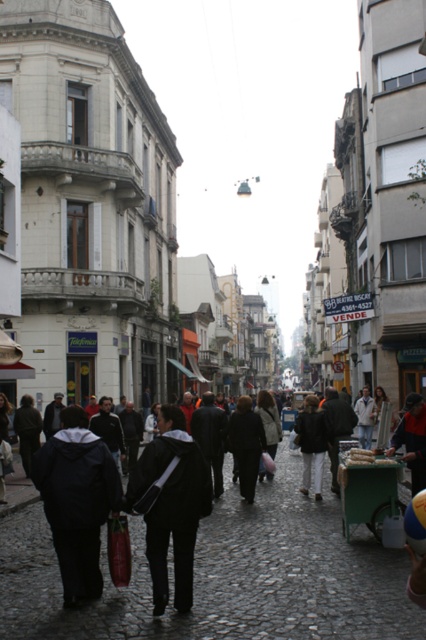
Which of these two, black fabric crowd at center or black fabric bag at center, stands shorter?

With less height is black fabric bag at center.

Between black fabric crowd at center and black fabric bag at center, which one appears on the left side from the viewer's perspective?

Positioned to the left is black fabric crowd at center.

The width and height of the screenshot is (426, 640). What do you see at coordinates (224, 576) in the screenshot?
I see `black fabric crowd at center` at bounding box center [224, 576].

Where is `black fabric crowd at center`? The height and width of the screenshot is (640, 426). black fabric crowd at center is located at coordinates (224, 576).